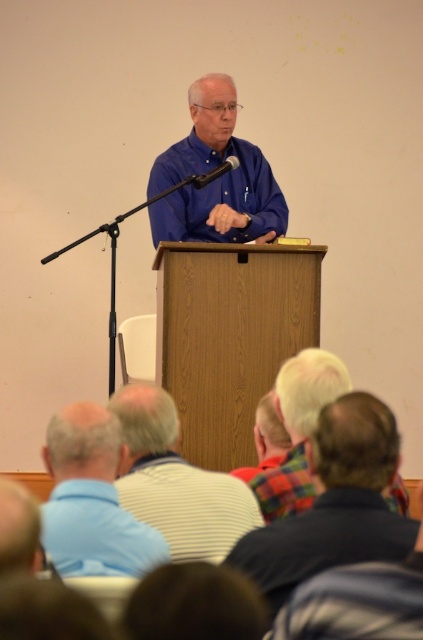
Question: From the image, what is the correct spatial relationship of plaid fabric shirt at center in relation to flannel shirt at center?

Choices:
 (A) above
 (B) below

Answer: (A)

Question: Which point is closer to the camera?

Choices:
 (A) plaid fabric shirt at lower center
 (B) plaid fabric shirt at center
 (C) blue striped shirt at lower left
 (D) flannel shirt at center

Answer: (A)

Question: Which of the following is the farthest from the observer?

Choices:
 (A) (235, 548)
 (B) (107, 422)
 (C) (269, 436)
 (D) (147, 188)

Answer: (D)

Question: Can you confirm if plaid fabric shirt at lower center is wider than plaid fabric shirt at center?

Choices:
 (A) yes
 (B) no

Answer: (B)

Question: Which object is the closest to the plaid fabric shirt at center?

Choices:
 (A) matte blue shirt at center
 (B) plaid fabric shirt at lower center
 (C) flannel shirt at center

Answer: (C)

Question: Can you confirm if plaid fabric shirt at lower center is bigger than matte blue shirt at center?

Choices:
 (A) no
 (B) yes

Answer: (A)